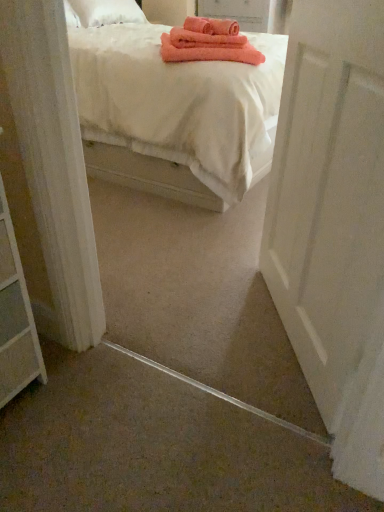
Question: Does white cotton bed at upper center appear on the right side of white matte door at right?

Choices:
 (A) yes
 (B) no

Answer: (B)

Question: Is white cotton bed at upper center smaller than white matte door at right?

Choices:
 (A) yes
 (B) no

Answer: (B)

Question: Does white cotton bed at upper center appear on the left side of white matte door at right?

Choices:
 (A) no
 (B) yes

Answer: (B)

Question: Would you say white matte door at right is part of white cotton bed at upper center's contents?

Choices:
 (A) yes
 (B) no

Answer: (B)

Question: Does white cotton bed at upper center have a lesser width compared to white matte door at right?

Choices:
 (A) yes
 (B) no

Answer: (B)

Question: Is white cotton bed at upper center positioned behind white matte door at right?

Choices:
 (A) yes
 (B) no

Answer: (A)

Question: Is white matte door at right not inside white cotton bed at upper center?

Choices:
 (A) yes
 (B) no

Answer: (A)

Question: Is white matte door at right thinner than white cotton bed at upper center?

Choices:
 (A) yes
 (B) no

Answer: (A)

Question: Is white matte door at right facing towards white cotton bed at upper center?

Choices:
 (A) no
 (B) yes

Answer: (A)

Question: Can you confirm if white matte door at right is bigger than white cotton bed at upper center?

Choices:
 (A) no
 (B) yes

Answer: (A)

Question: Is white matte door at right far from white cotton bed at upper center?

Choices:
 (A) yes
 (B) no

Answer: (B)

Question: From the image's perspective, is white matte door at right on white cotton bed at upper center?

Choices:
 (A) yes
 (B) no

Answer: (B)

Question: From a real-world perspective, is white matte door at right above or below white cotton bed at upper center?

Choices:
 (A) above
 (B) below

Answer: (A)